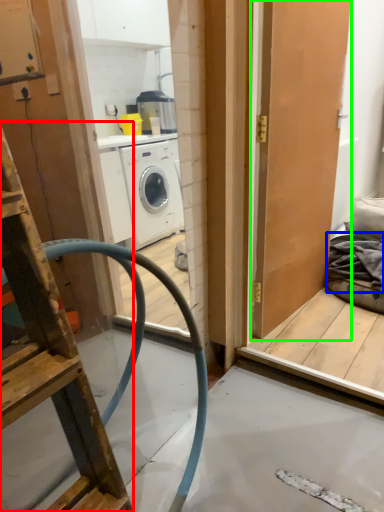
Question: Based on their relative distances, which object is farther from ladder (highlighted by a red box)? Choose from material (highlighted by a blue box) and door (highlighted by a green box).

Choices:
 (A) material
 (B) door

Answer: (A)